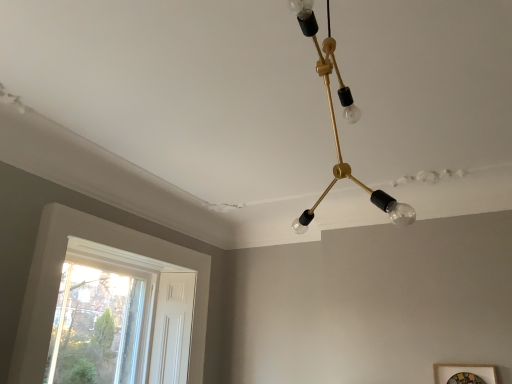
Question: Is gold metallic chandelier at upper center next to white wood window at lower left?

Choices:
 (A) no
 (B) yes

Answer: (A)

Question: Is gold metallic chandelier at upper center thinner than white wood window at lower left?

Choices:
 (A) no
 (B) yes

Answer: (A)

Question: Is the depth of gold metallic chandelier at upper center greater than that of white wood window at lower left?

Choices:
 (A) no
 (B) yes

Answer: (A)

Question: Would you say gold metallic chandelier at upper center is outside white wood window at lower left?

Choices:
 (A) yes
 (B) no

Answer: (A)

Question: From the image's perspective, is gold metallic chandelier at upper center over white wood window at lower left?

Choices:
 (A) no
 (B) yes

Answer: (B)

Question: From the image's perspective, relative to white wood window at lower left, is gold metallic chandelier at upper center above or below?

Choices:
 (A) below
 (B) above

Answer: (B)

Question: Relative to white wood window at lower left, is gold metallic chandelier at upper center in front or behind?

Choices:
 (A) behind
 (B) front

Answer: (B)

Question: Is gold metallic chandelier at upper center wider or thinner than white wood window at lower left?

Choices:
 (A) wide
 (B) thin

Answer: (A)

Question: Is point (325, 66) closer or farther from the camera than point (92, 380)?

Choices:
 (A) closer
 (B) farther

Answer: (A)

Question: Visually, is white wood window at lower left positioned to the left or to the right of gold metallic chandelier at upper center?

Choices:
 (A) left
 (B) right

Answer: (A)

Question: In terms of width, does white wood window at lower left look wider or thinner when compared to gold metallic chandelier at upper center?

Choices:
 (A) wide
 (B) thin

Answer: (B)

Question: Is white wood window at lower left situated inside gold metallic chandelier at upper center or outside?

Choices:
 (A) outside
 (B) inside

Answer: (A)

Question: From a real-world perspective, relative to gold metallic chandelier at upper center, is white wood window at lower left vertically above or below?

Choices:
 (A) above
 (B) below

Answer: (B)

Question: Is wooden picture frame at lower right in front of or behind gold metallic chandelier at upper center in the image?

Choices:
 (A) front
 (B) behind

Answer: (B)

Question: Considering the positions of wooden picture frame at lower right and gold metallic chandelier at upper center in the image, is wooden picture frame at lower right bigger or smaller than gold metallic chandelier at upper center?

Choices:
 (A) big
 (B) small

Answer: (B)